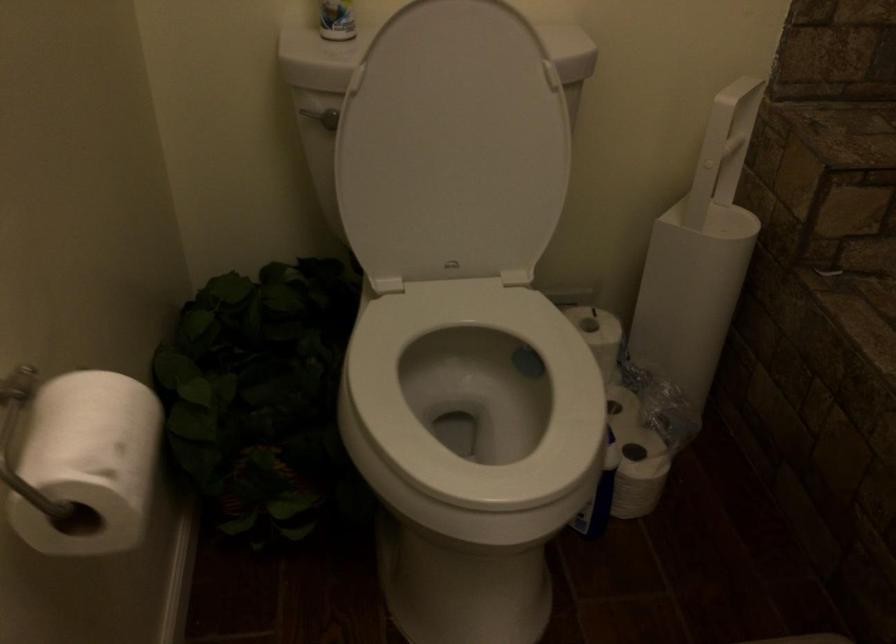
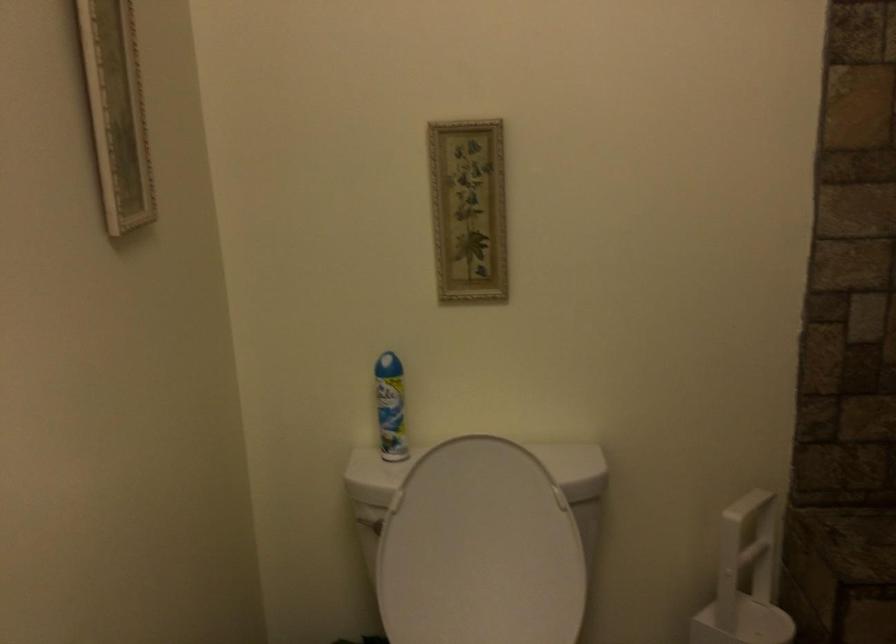
Locate, in the second image, the point that corresponds to pixel 316 114 in the first image.

(368, 522)